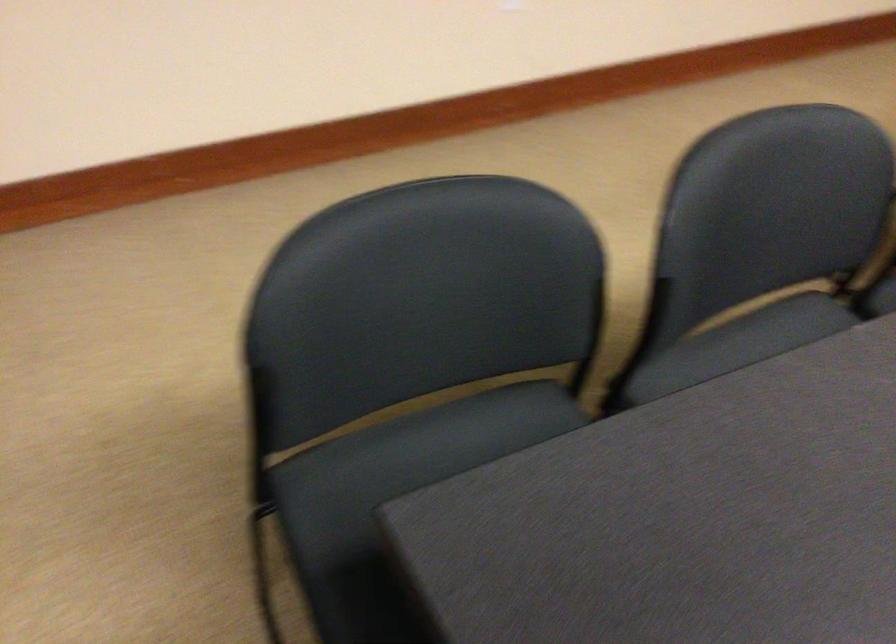
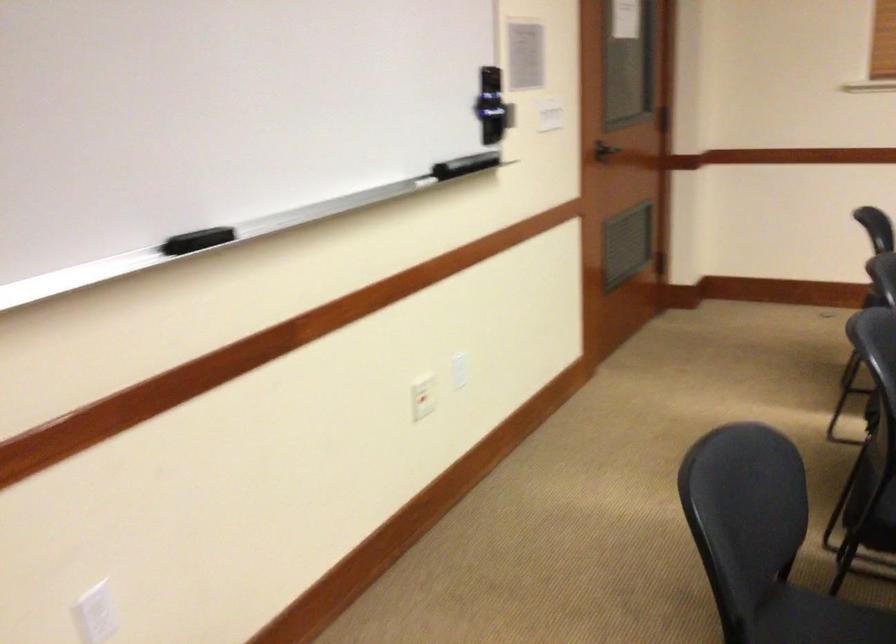
Question: In a continuous first-person perspective shot, in which direction is the camera moving?

Choices:
 (A) Left
 (B) Right
 (C) Forward
 (D) Backward

Answer: (D)